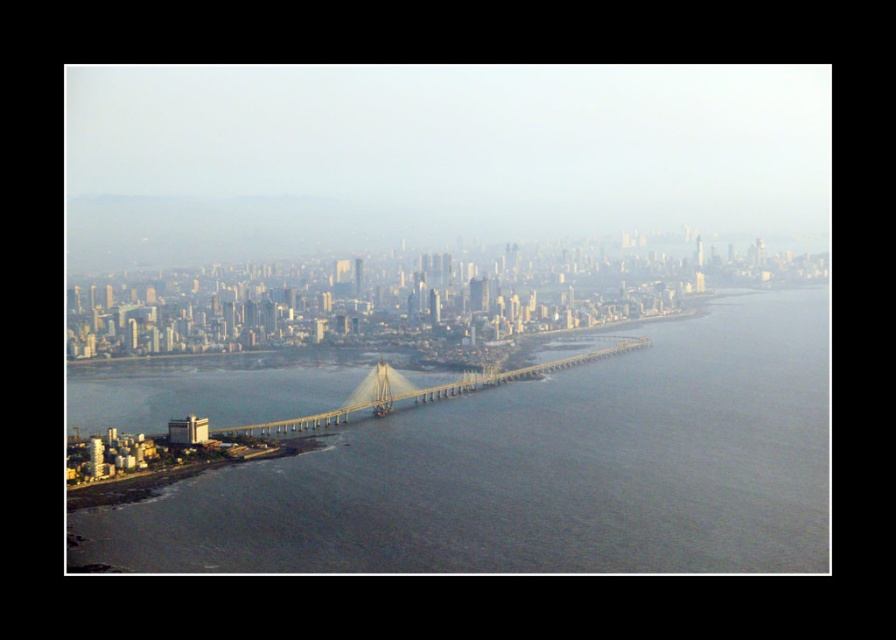
You are a delivery drone with a wingspan of 10 feet. You need to fly through the gap between the gray concrete bridge at center and the metallic gray bridge at center. Can you safely pass through this gap?

The gap between the gray concrete bridge at center and the metallic gray bridge at center is 213.30 feet wide. Since your wingspan is only 10 feet, you can safely pass through the gap as there is ample space available.

You are a drone operator trying to capture a photo of the gray concrete bridge at center and the metallic gray bridge at center from above. Can you fly your drone in a straight path between them to get a clear shot?

The gray concrete bridge at center is below the metallic gray bridge at center, so flying a drone in a straight path between them would not be possible as they are stacked vertically rather than side by side.